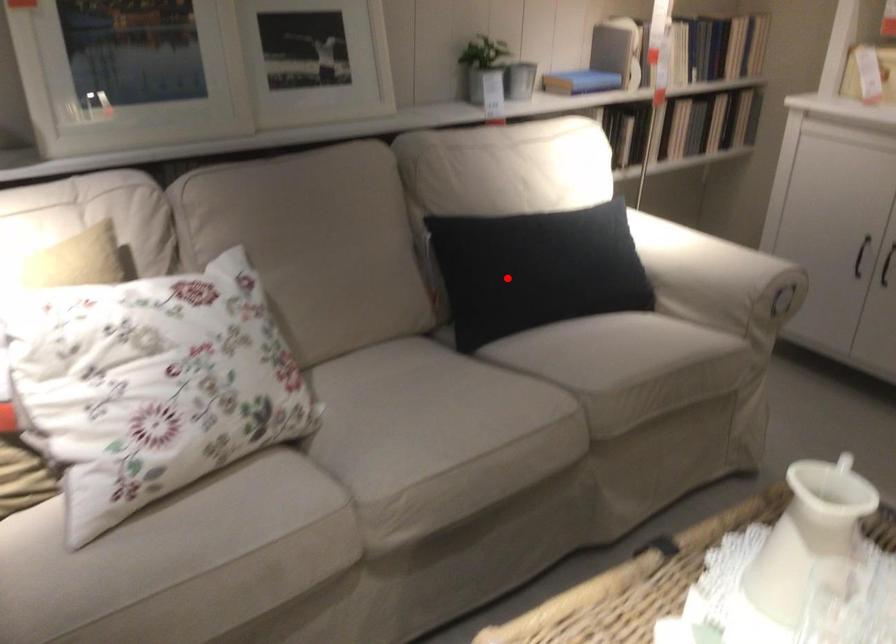
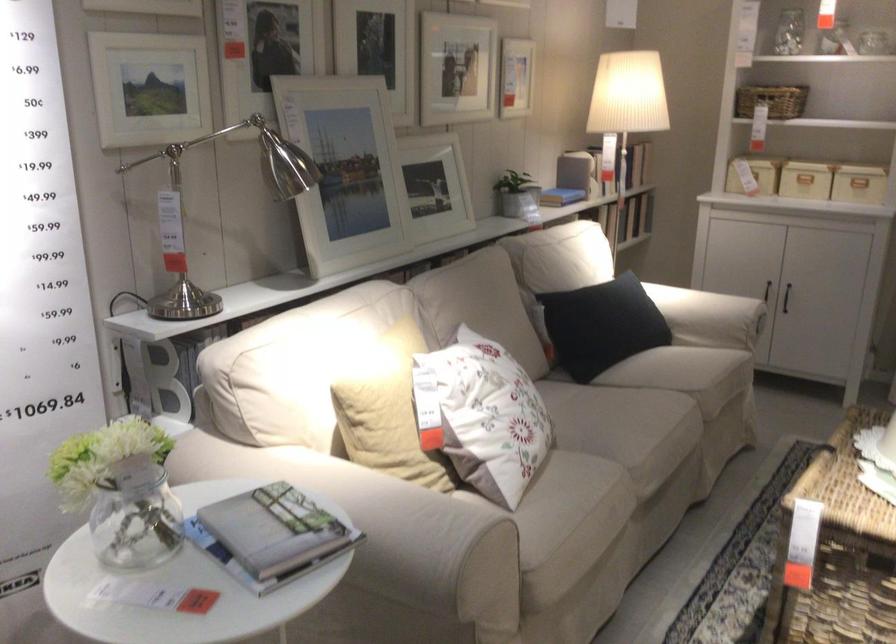
Question: I am providing you with two images of the same scene from different viewpoints. In image1, a red point is highlighted. Considering the same 3D point in image2, which of the following is correct?

Choices:
 (A) It is closer
 (B) It is farther

Answer: (B)